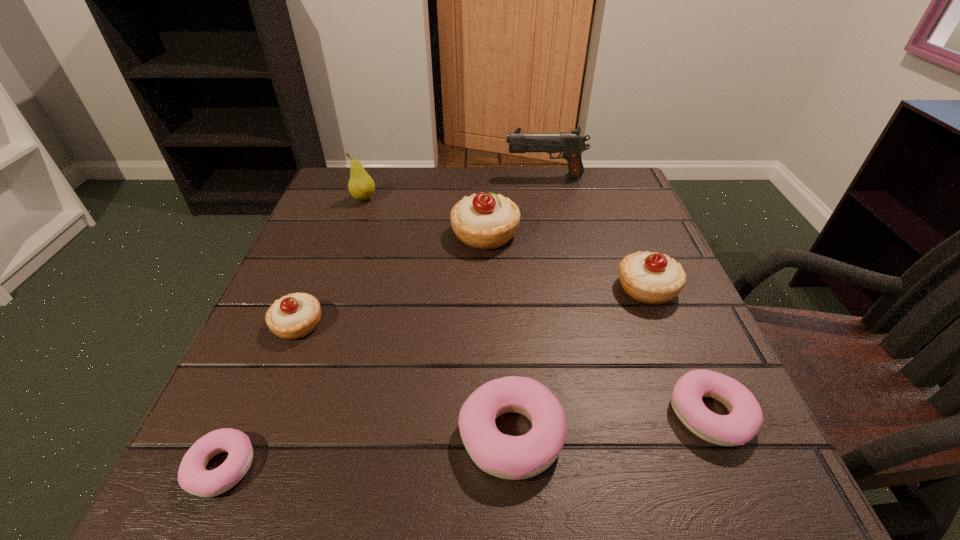
Find the location of a particular element. vacant space at the near right corner is located at coordinates (755, 496).

This screenshot has width=960, height=540. I want to click on free space between the third shortest object and the farthest beige pastry, so click(498, 335).

This screenshot has height=540, width=960. I want to click on empty space between the fifth shortest pastry and the gun, so click(x=596, y=232).

Image resolution: width=960 pixels, height=540 pixels. I want to click on free spot between the second shortest object and the second tallest pastry, so click(679, 352).

The height and width of the screenshot is (540, 960). What are the coordinates of `vacant space in between the third tallest object and the shortest pastry` in the screenshot? It's located at coord(353,351).

The width and height of the screenshot is (960, 540). In order to click on empty location between the farthest object and the second shortest pastry in this screenshot , I will do (x=628, y=295).

The image size is (960, 540). I want to click on empty location between the second beige pastry from right to left and the rightmost beige pastry, so click(x=566, y=261).

You are a GUI agent. You are given a task and a screenshot of the screen. Output one action in this format:
    pyautogui.click(x=<x>, y=<y>)
    Task: Click on the free space between the seventh tallest object and the second pink pastry from left to right
    This screenshot has width=960, height=540.
    Given the screenshot: What is the action you would take?
    611,426

At what (x,y) coordinates should I click in order to perform the action: click on vacant space that is in between the third tallest pastry and the biggest pink pastry. Please return your answer as a coordinate pair (x, y). This screenshot has width=960, height=540. Looking at the image, I should click on (404, 380).

Locate an element on the screen. This screenshot has width=960, height=540. vacant region between the pear and the fourth tallest pastry is located at coordinates (438, 318).